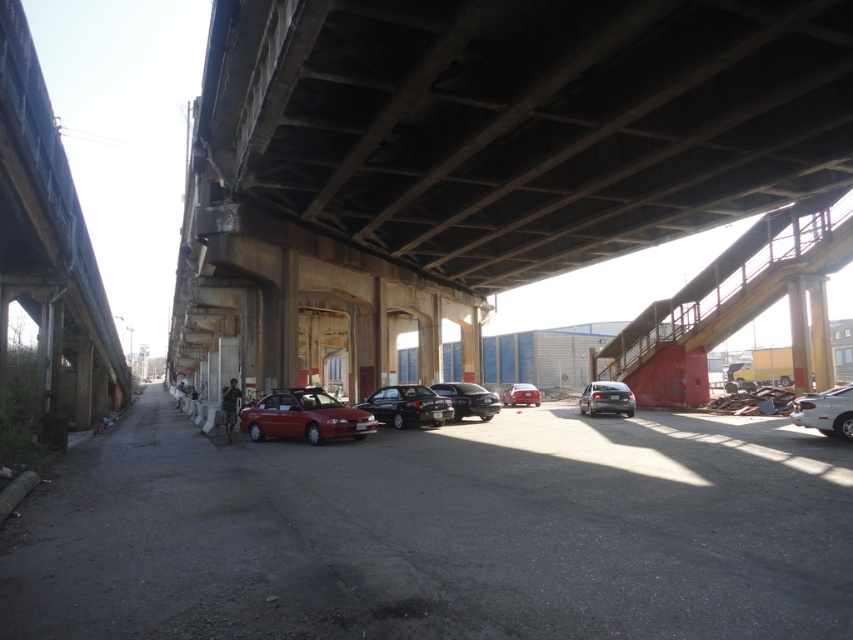
Is shiny red car at center to the left of white glossy sedan at right from the viewer's perspective?

Indeed, shiny red car at center is positioned on the left side of white glossy sedan at right.

Between shiny red car at center and white glossy sedan at right, which one is positioned lower?

shiny red car at center is lower down.

Is point (383, 524) farther from viewer compared to point (819, 426)?

That is False.

I want to click on shiny red car at center, so click(x=438, y=532).

Is shiny black sedan at center shorter than white glossy sedan at right?

Indeed, shiny black sedan at center has a lesser height compared to white glossy sedan at right.

How much distance is there between shiny black sedan at center and white glossy sedan at right?

shiny black sedan at center and white glossy sedan at right are 12.89 meters apart from each other.

You are a GUI agent. You are given a task and a screenshot of the screen. Output one action in this format:
    pyautogui.click(x=<x>, y=<y>)
    Task: Click on the shiny black sedan at center
    The height and width of the screenshot is (640, 853).
    Given the screenshot: What is the action you would take?
    pyautogui.click(x=407, y=404)

At what (x,y) coordinates should I click in order to perform the action: click on shiny black sedan at center. Please return your answer as a coordinate pair (x, y). The width and height of the screenshot is (853, 640). Looking at the image, I should click on (407, 404).

Which of these two, white glossy sedan at right or glossy red car at center, stands taller?

white glossy sedan at right

Who is more forward, (849, 426) or (521, 392)?

Point (849, 426)

At what (x,y) coordinates should I click in order to perform the action: click on white glossy sedan at right. Please return your answer as a coordinate pair (x, y). Looking at the image, I should click on (825, 412).